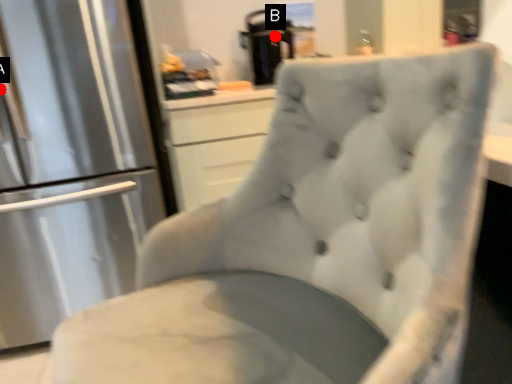
Question: Two points are circled on the image, labeled by A and B beside each circle. Among these points, which one is farthest from the camera?

Choices:
 (A) A is further
 (B) B is further

Answer: (B)